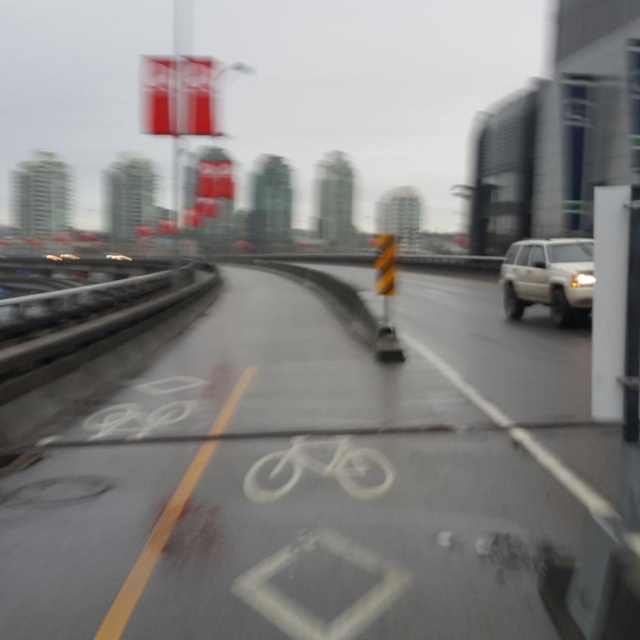
Does white painted bicycle lane at center lie behind beige matte suv at right?

No, it is in front of beige matte suv at right.

Does point (474, 428) lie in front of point (540, 298)?

Yes.

Locate an element on the screen. The width and height of the screenshot is (640, 640). white painted bicycle lane at center is located at coordinates (310, 481).

Does point (552, 257) come behind point (390, 272)?

Yes, point (552, 257) is behind point (390, 272).

Looking at this image, is beige matte suv at right positioned at the back of yellow striped traffic cone at center?

Yes.

What are the coordinates of `beige matte suv at right` in the screenshot? It's located at (548, 276).

Does white painted bicycle lane at center appear on the right side of white matte bicycle at center?

Yes, white painted bicycle lane at center is to the right of white matte bicycle at center.

Measure the distance between white painted bicycle lane at center and camera.

white painted bicycle lane at center and camera are 2.80 meters apart from each other.

In order to click on white painted bicycle lane at center in this screenshot , I will do `click(310, 481)`.